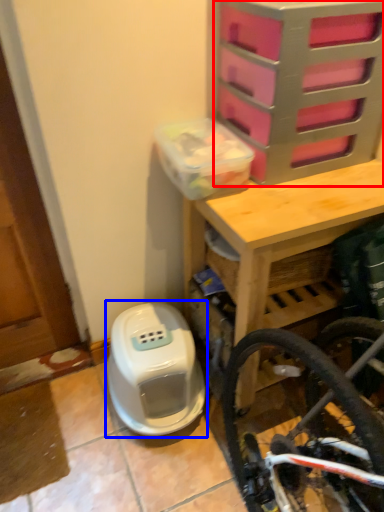
Question: Which object is further to the camera taking this photo, drawer (highlighted by a red box) or water heater (highlighted by a blue box)?

Choices:
 (A) drawer
 (B) water heater

Answer: (B)